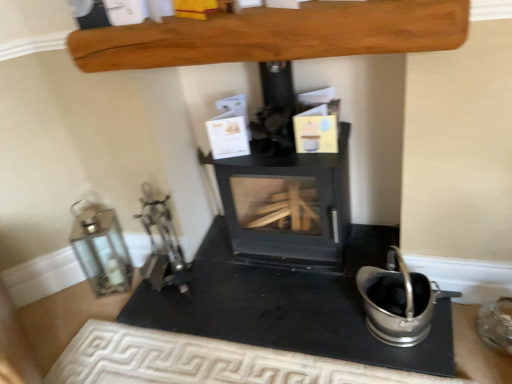
Find the location of a particular element. The height and width of the screenshot is (384, 512). free space to the back side of transparent glass jar at lower right, positioned as the third appliance in left-to-right order is located at coordinates (468, 314).